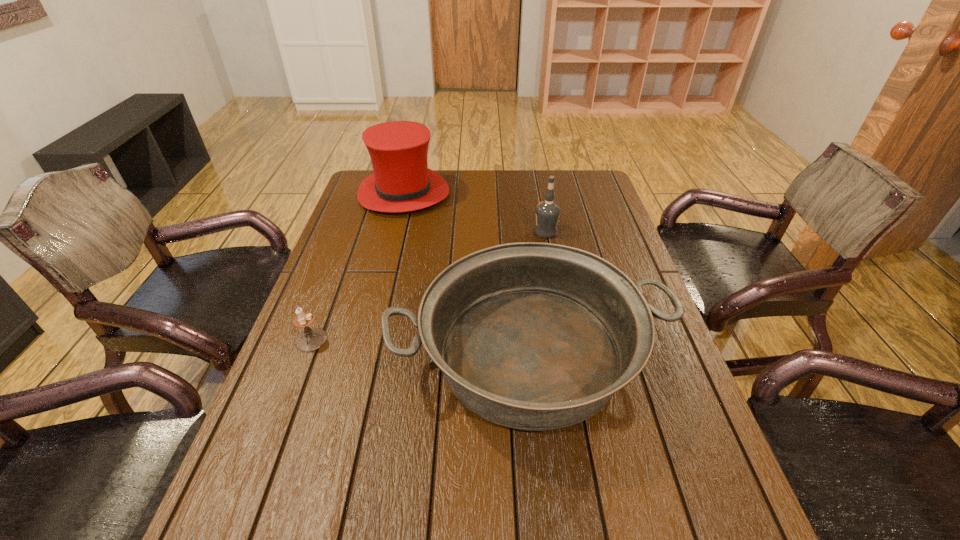
Locate an element on the screen. The image size is (960, 540). hat is located at coordinates (402, 182).

The image size is (960, 540). I want to click on vodka, so click(x=548, y=211).

The width and height of the screenshot is (960, 540). Find the location of `pan`. pan is located at coordinates [x=533, y=336].

Identify the location of candle holder. This screenshot has height=540, width=960. coord(311,339).

Identify the location of free space located on the right of the farthest object. The height and width of the screenshot is (540, 960). (486, 194).

What are the coordinates of `vacant position located 0.350m on the front label of the third nearest object` in the screenshot? It's located at (424, 232).

Locate an element on the screen. vacant space located on the front label of the third nearest object is located at coordinates (444, 232).

Find the location of a particular element. The width and height of the screenshot is (960, 540). vacant space located 0.280m on the front label of the third nearest object is located at coordinates (446, 232).

I want to click on free spot located on the left of the pan, so click(358, 356).

Identify the location of free space located 0.130m on the front of the shortest object. (288, 400).